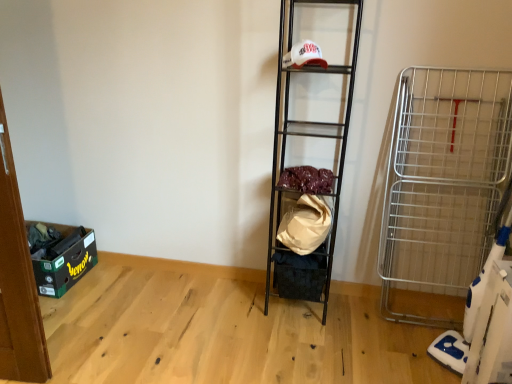
The height and width of the screenshot is (384, 512). In order to click on empty space that is to the right of metallic black shelf at center in this screenshot , I will do `click(357, 317)`.